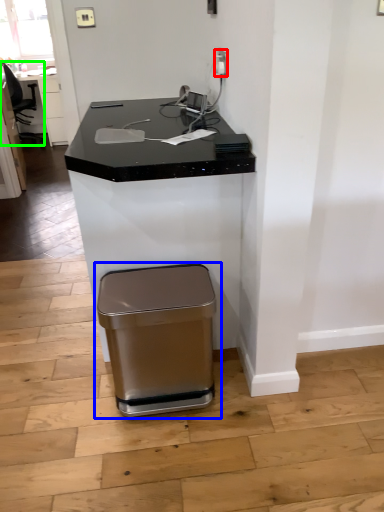
Question: Which object is the closest to the electric outlet (highlighted by a red box)? Choose among these: waste container (highlighted by a blue box) or swivel chair (highlighted by a green box).

Choices:
 (A) waste container
 (B) swivel chair

Answer: (A)